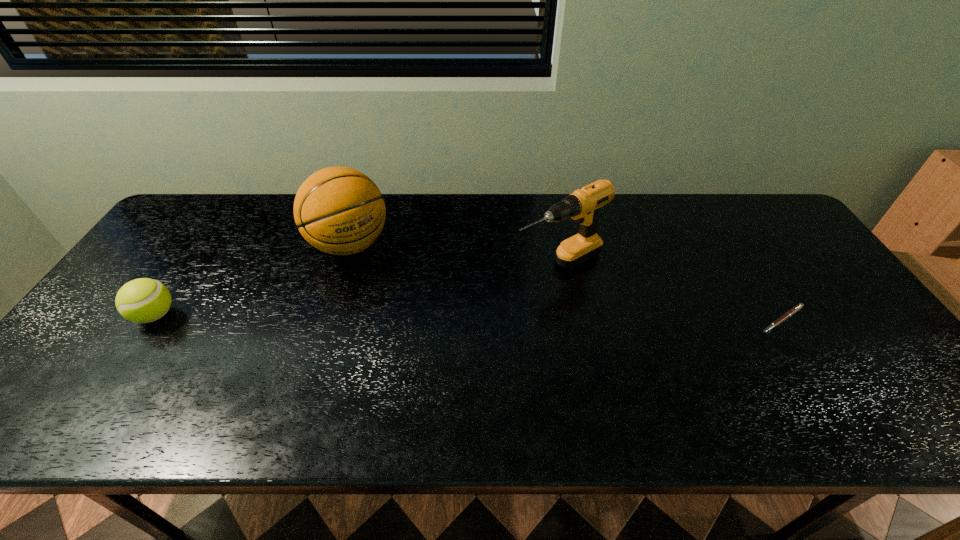
Image resolution: width=960 pixels, height=540 pixels. I want to click on vacant area that lies between the third object from right to left and the pen, so click(x=565, y=282).

The width and height of the screenshot is (960, 540). I want to click on the second closest object to the rightmost object, so click(338, 210).

Find the location of a particular element. The height and width of the screenshot is (540, 960). object identified as the closest to the third object from right to left is located at coordinates (144, 300).